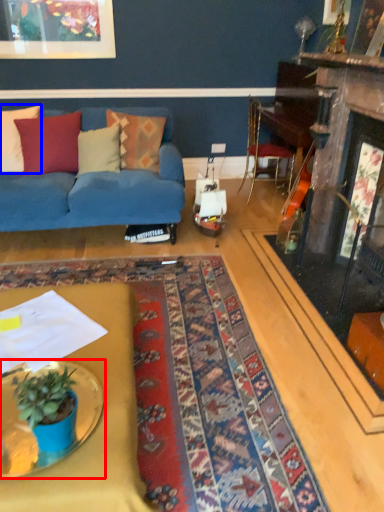
Question: Which object appears closest to the camera in this image, table (highlighted by a red box) or pillow (highlighted by a blue box)?

Choices:
 (A) table
 (B) pillow

Answer: (A)